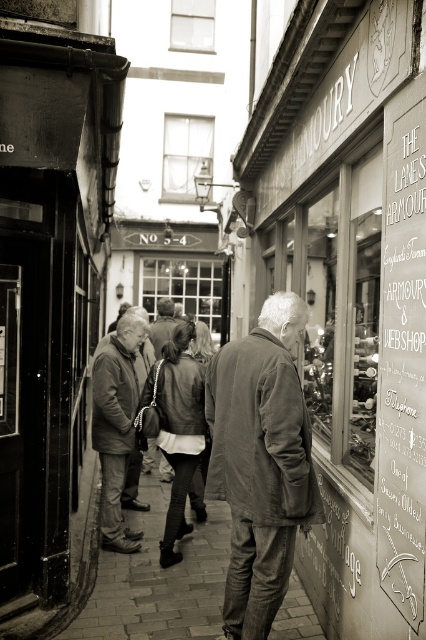
Question: Which point is closer to the camera?

Choices:
 (A) white chalkboard sign at right
 (B) leather jacket at center
 (C) matte brown jacket at center
 (D) matte gray jacket at center

Answer: (A)

Question: Is the position of brick pavement at center less distant than that of matte brown jacket at center?

Choices:
 (A) no
 (B) yes

Answer: (B)

Question: Can you confirm if matte gray jacket at center is wider than brick pavement at center?

Choices:
 (A) yes
 (B) no

Answer: (B)

Question: Does brick pavement at center have a lesser width compared to leather jacket at center?

Choices:
 (A) yes
 (B) no

Answer: (B)

Question: Which point is farther to the camera?

Choices:
 (A) (186, 600)
 (B) (226, 426)

Answer: (A)

Question: Among these objects, which one is nearest to the camera?

Choices:
 (A) matte brown jacket at center
 (B) brick pavement at center
 (C) matte gray jacket at center
 (D) matte wooden signboard at center

Answer: (C)